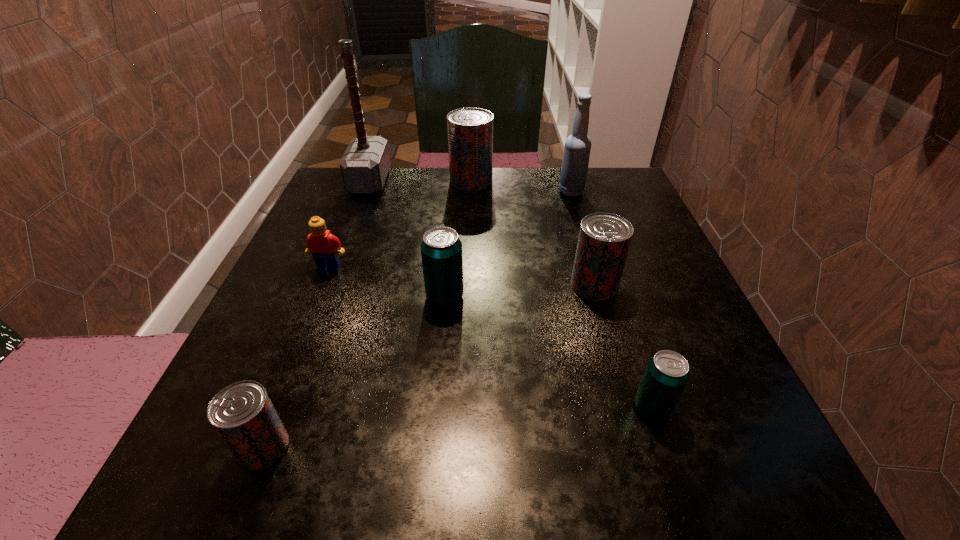
The height and width of the screenshot is (540, 960). I want to click on the leftmost red beer can, so click(242, 413).

Locate an element on the screen. Image resolution: width=960 pixels, height=540 pixels. the leftmost beer can is located at coordinates (242, 413).

The image size is (960, 540). What are the coordinates of `the right teal beer can` in the screenshot? It's located at [667, 373].

Image resolution: width=960 pixels, height=540 pixels. In order to click on the second nearest object in this screenshot , I will do `click(667, 373)`.

Identify the location of vacant space located on the striking surface of the hammer. (455, 181).

Find the location of a particular element. The width and height of the screenshot is (960, 540). vacant space located 0.070m on the back of the bottle is located at coordinates (564, 172).

At what (x,y) coordinates should I click in order to perform the action: click on free point located on the left of the farthest red beer can. Please return your answer as a coordinate pair (x, y). This screenshot has height=540, width=960. Looking at the image, I should click on (430, 181).

The image size is (960, 540). Identify the location of vacant position located on the left of the farther teal beer can. (343, 296).

Image resolution: width=960 pixels, height=540 pixels. Identify the location of blank space located on the back of the second nearest red beer can. (579, 234).

Where is `free space located on the face of the Lego`? The width and height of the screenshot is (960, 540). free space located on the face of the Lego is located at coordinates (300, 341).